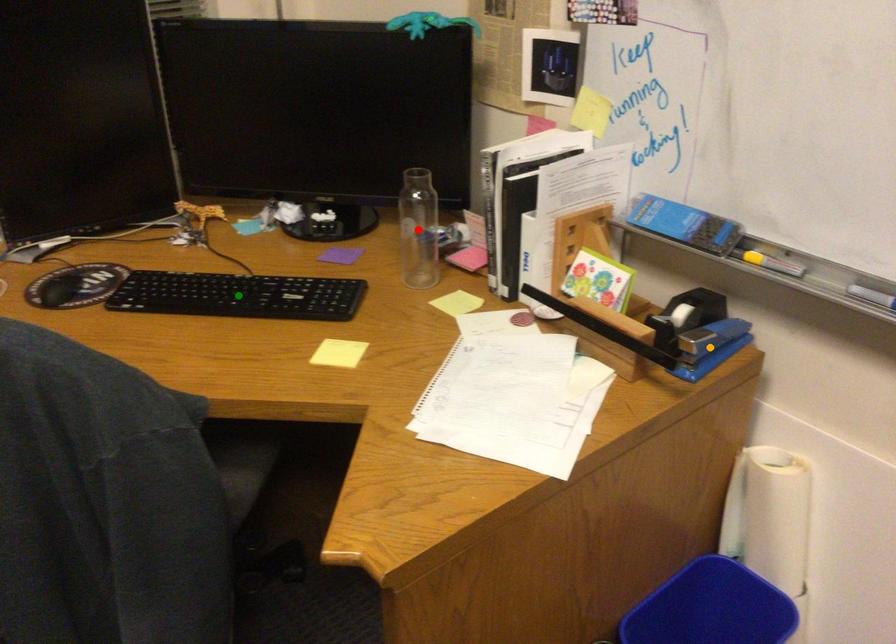
Looking at this image, order these from nearest to farthest:
orange point
red point
green point

1. orange point
2. green point
3. red point